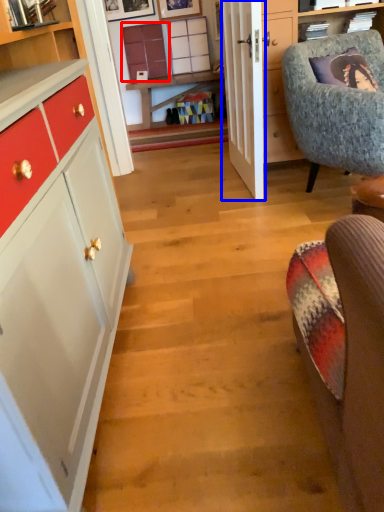
Question: Which of the following is the closest to the observer, cabinetry (highlighted by a red box) or door (highlighted by a blue box)?

Choices:
 (A) cabinetry
 (B) door

Answer: (B)